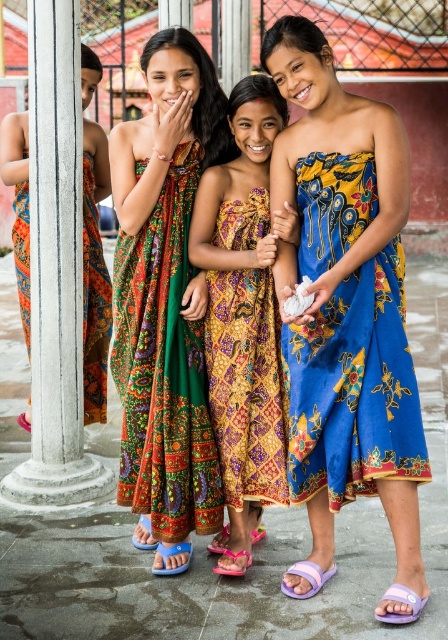
Does blue plastic sandal at lower left have a lesser height compared to purple plastic sandal at lower center?

Incorrect, blue plastic sandal at lower left's height does not fall short of purple plastic sandal at lower center's.

Does blue plastic sandal at lower left appear over purple plastic sandal at lower center?

Actually, blue plastic sandal at lower left is below purple plastic sandal at lower center.

Is point (150, 525) behind point (30, 422)?

No.

Where is `blue plastic sandal at lower left`? blue plastic sandal at lower left is located at coordinates (142, 545).

Between purple fabric sandal at lower center and blue plastic sandal at lower left, which one is positioned lower?

Positioned lower is purple fabric sandal at lower center.

Is purple fabric sandal at lower center wider than blue plastic sandal at lower left?

Yes, purple fabric sandal at lower center is wider than blue plastic sandal at lower left.

Which is in front, point (310, 579) or point (154, 544)?

Positioned in front is point (310, 579).

I want to click on purple fabric sandal at lower center, so click(306, 579).

Is matte orange dress at left thinner than blue rubber sandal at lower left?

Yes, matte orange dress at left is thinner than blue rubber sandal at lower left.

Which is in front, point (90, 152) or point (163, 561)?

Positioned in front is point (163, 561).

This screenshot has height=640, width=448. What are the coordinates of `matte orange dress at left` in the screenshot? It's located at (94, 275).